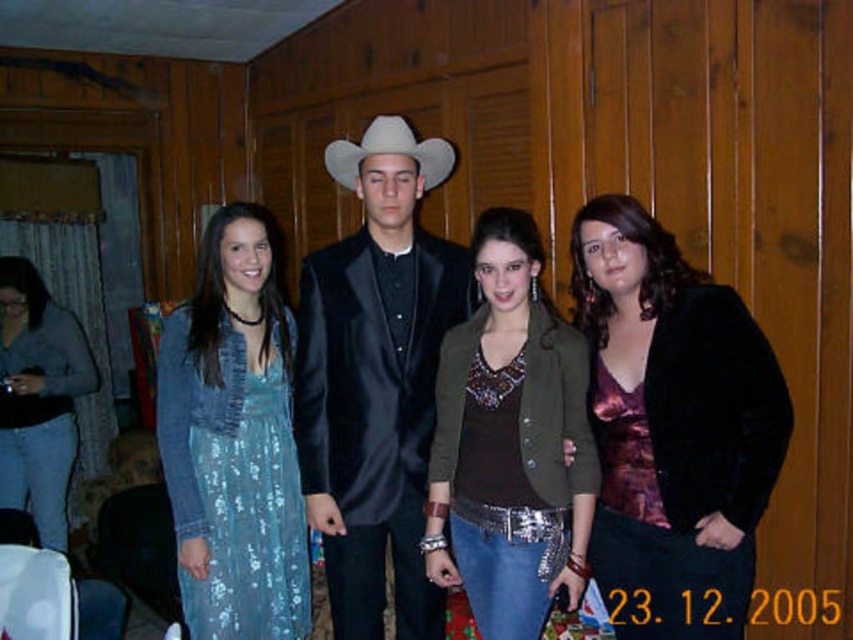
Based on the scene description, which object is shorter between the shiny purple blouse at center and the satin black suit at center?

The shiny purple blouse at center is shorter than the satin black suit at center.